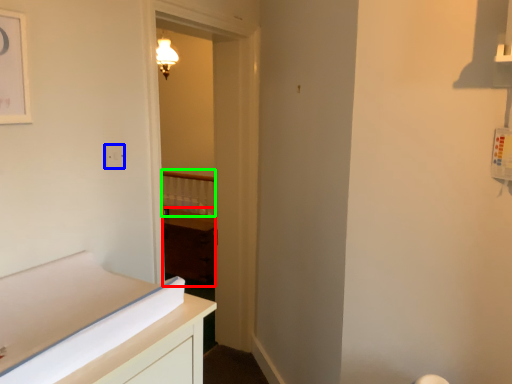
Question: Which is farther away from cabinetry (highlighted by a red box)? electric outlet (highlighted by a blue box) or balustrade (highlighted by a green box)?

Choices:
 (A) electric outlet
 (B) balustrade

Answer: (A)